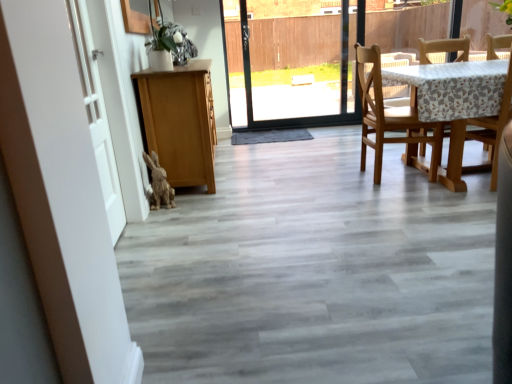
Question: Does white matte barn door at left touch white matte door at left?

Choices:
 (A) no
 (B) yes

Answer: (A)

Question: Is white matte barn door at left shorter than white matte door at left?

Choices:
 (A) no
 (B) yes

Answer: (A)

Question: Is white matte barn door at left positioned before white matte door at left?

Choices:
 (A) yes
 (B) no

Answer: (A)

Question: Is white matte barn door at left facing towards white matte door at left?

Choices:
 (A) yes
 (B) no

Answer: (A)

Question: Would you say white matte barn door at left contains white matte door at left?

Choices:
 (A) no
 (B) yes

Answer: (B)

Question: From a real-world perspective, relative to white matte door at left, is wooden chair at right, the first chair in the right-to-left sequence, vertically above or below?

Choices:
 (A) above
 (B) below

Answer: (B)

Question: Is wooden chair at right, the first chair in the right-to-left sequence, taller or shorter than white matte door at left?

Choices:
 (A) short
 (B) tall

Answer: (A)

Question: From the image's perspective, relative to white matte door at left, is wooden chair at right, the 2th chair viewed from the left, above or below?

Choices:
 (A) above
 (B) below

Answer: (A)

Question: In terms of size, does wooden chair at right, the first chair in the right-to-left sequence, appear bigger or smaller than white matte door at left?

Choices:
 (A) big
 (B) small

Answer: (A)

Question: Considering the relative positions of white matte door at left and white matte barn door at left in the image provided, is white matte door at left to the left or to the right of white matte barn door at left?

Choices:
 (A) right
 (B) left

Answer: (B)

Question: In terms of size, does white matte door at left appear bigger or smaller than white matte barn door at left?

Choices:
 (A) big
 (B) small

Answer: (B)

Question: Is point (82, 62) closer or farther from the camera than point (95, 339)?

Choices:
 (A) farther
 (B) closer

Answer: (A)

Question: In terms of height, does white matte door at left look taller or shorter compared to white matte barn door at left?

Choices:
 (A) short
 (B) tall

Answer: (A)

Question: Is fuzzy brown rabbit at lower left in front of or behind wooden chair at right, the 2th chair viewed from the left, in the image?

Choices:
 (A) front
 (B) behind

Answer: (B)

Question: In terms of width, does fuzzy brown rabbit at lower left look wider or thinner when compared to wooden chair at right, the 2th chair viewed from the left?

Choices:
 (A) wide
 (B) thin

Answer: (B)